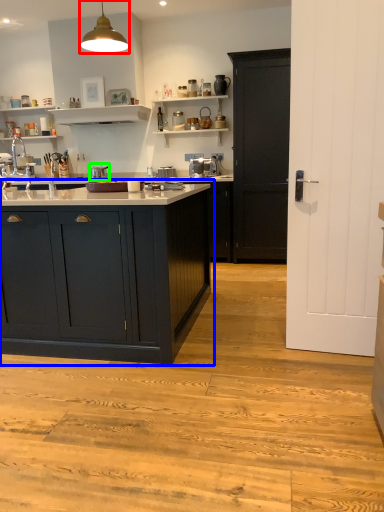
Question: Which object is positioned closest to light fixture (highlighted by a red box)? Select from cabinetry (highlighted by a blue box) and appliance (highlighted by a green box).

Choices:
 (A) cabinetry
 (B) appliance

Answer: (A)